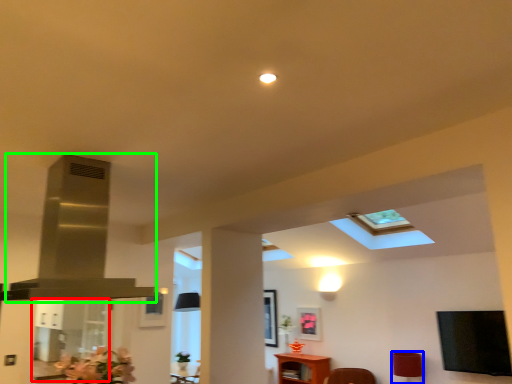
Question: Which object is the farthest from glass door (highlighted by a red box)? Choose among these: lamp (highlighted by a blue box) or exhaust hood (highlighted by a green box).

Choices:
 (A) lamp
 (B) exhaust hood

Answer: (A)